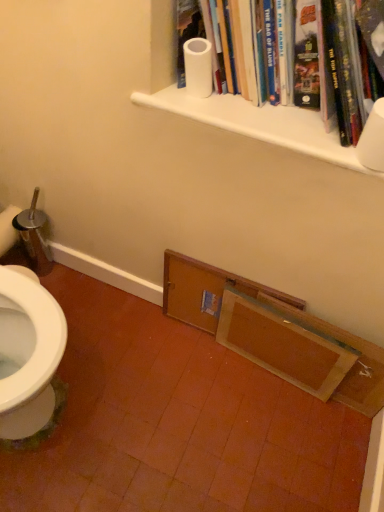
This screenshot has width=384, height=512. In order to click on free location above white matte shelf at upper center, arranged as the second shelf when ordered from the bottom (from a real-world perspective) in this screenshot , I will do [x=261, y=109].